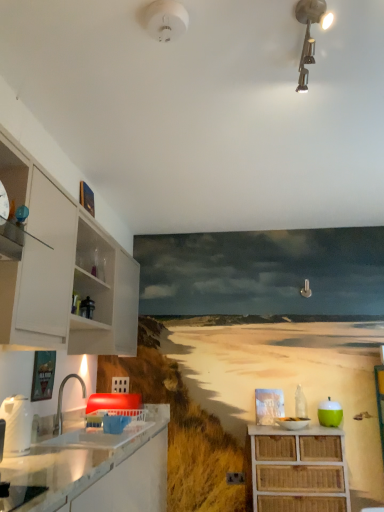
Question: In terms of height, does metallic track lighting at upper center, which is the second light fixture from left to right, look taller or shorter compared to white glossy sink at lower left?

Choices:
 (A) short
 (B) tall

Answer: (A)

Question: Looking at the image, does metallic track lighting at upper center, which appears as the 1th light fixture when viewed from the right, seem bigger or smaller compared to white glossy sink at lower left?

Choices:
 (A) big
 (B) small

Answer: (B)

Question: Which object is the farthest from the white glossy countertop at lower left?

Choices:
 (A) white glossy kettle at left, which ranks as the first appliance in front-to-back order
 (B) green matte apple at right, which is the 2th appliance in front-to-back order
 (C) white glossy cabinet at left, which is the first cabinetry in top-to-bottom order
 (D) white glossy sink at lower left
 (E) white plastic smoke detector at upper center, which is the 2th light fixture in right-to-left order

Answer: (E)

Question: Estimate the real-world distances between objects in this image. Which object is closer to the white glossy cabinet at left, the first cabinetry positioned from the left?

Choices:
 (A) woven wood cabinet at lower right, the second cabinetry when ordered from top to bottom
 (B) metallic track lighting at upper center, which appears as the 1th light fixture when viewed from the right
 (C) green matte apple at right, which is the 2th appliance in front-to-back order
 (D) white glossy sink at lower left
 (E) white glossy countertop at lower left

Answer: (D)